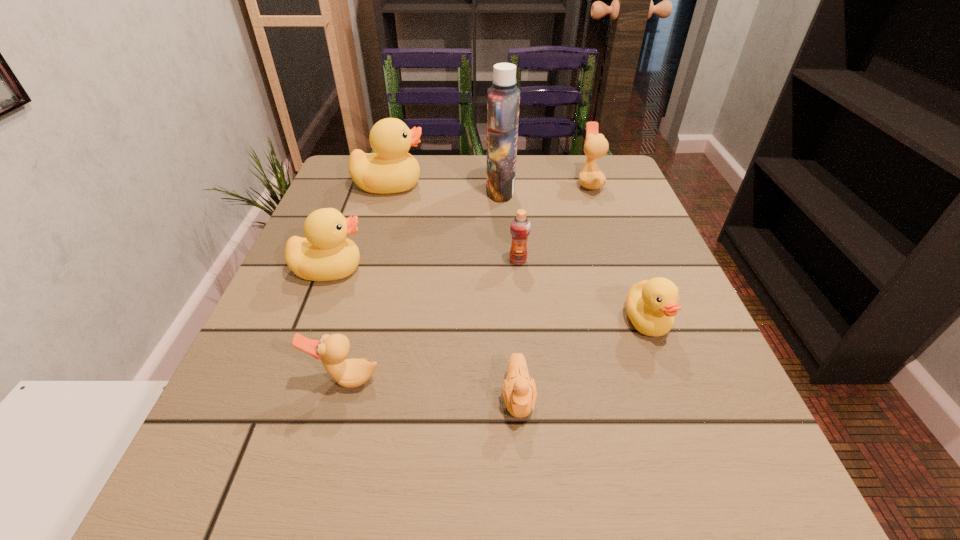
Locate an element on the screen. the fourth farthest duck is located at coordinates (651, 305).

Where is `the nearer tan duck`? This screenshot has height=540, width=960. the nearer tan duck is located at coordinates (333, 349).

Locate an element on the screen. Image resolution: width=960 pixels, height=540 pixels. the smaller tan duck is located at coordinates (333, 349).

Locate an element on the screen. duckling is located at coordinates (519, 393).

Where is `vacant space located 0.140m on the front label of the tallest object`? vacant space located 0.140m on the front label of the tallest object is located at coordinates (429, 191).

Find the location of `vacant space located 0.200m on the front label of the tallest object`. vacant space located 0.200m on the front label of the tallest object is located at coordinates (404, 191).

Identify the location of vacant area situated on the front label of the tallest object. This screenshot has height=540, width=960. (359, 191).

Locate an element on the screen. The height and width of the screenshot is (540, 960). vacant region located at the beak of the tallest duck is located at coordinates (506, 185).

Identify the location of vacant position located at the beak of the second farthest yellow duck. (571, 269).

Identify the location of free region located 0.240m on the beak of the farther tan duck. The height and width of the screenshot is (540, 960). (481, 183).